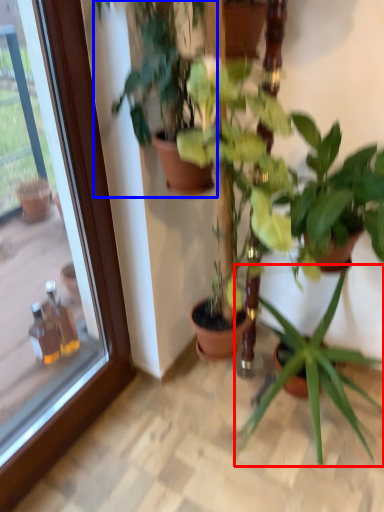
Question: Which point is closer to the camera, houseplant (highlighted by a red box) or houseplant (highlighted by a blue box)?

Choices:
 (A) houseplant
 (B) houseplant

Answer: (B)